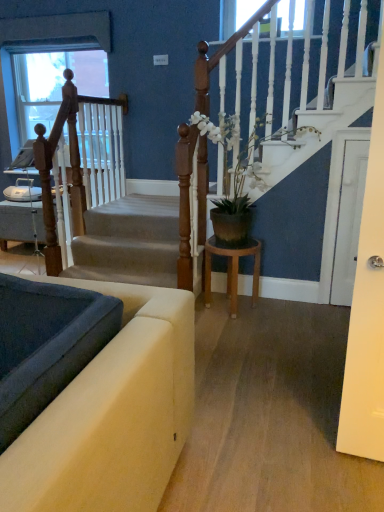
Image resolution: width=384 pixels, height=512 pixels. Identify the location of vacant space in wooden stool at center (from a real-world perspective). (230, 310).